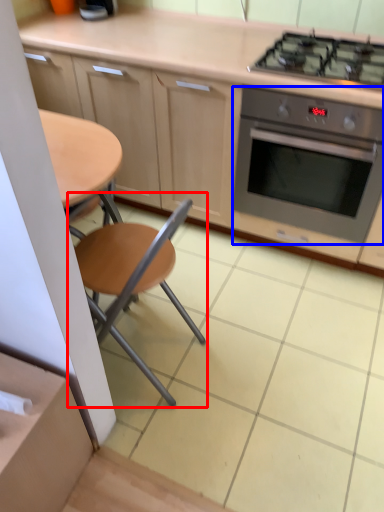
Question: Which object appears farthest to the camera in this image, chair (highlighted by a red box) or kitchen appliance (highlighted by a blue box)?

Choices:
 (A) chair
 (B) kitchen appliance

Answer: (B)